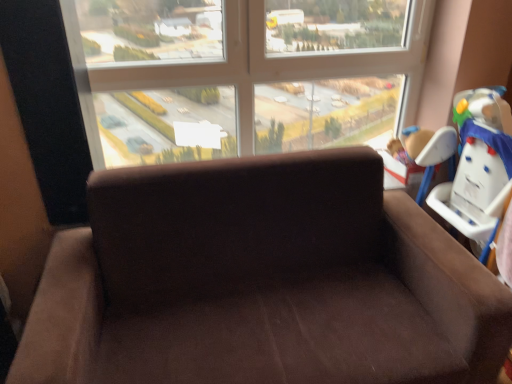
Question: Is the depth of transparent glass window at upper center less than that of brown plush toy at upper right?

Choices:
 (A) no
 (B) yes

Answer: (B)

Question: Is transparent glass window at upper center touching brown plush toy at upper right?

Choices:
 (A) yes
 (B) no

Answer: (B)

Question: Is transparent glass window at upper center smaller than brown plush toy at upper right?

Choices:
 (A) no
 (B) yes

Answer: (A)

Question: Considering the relative sizes of transparent glass window at upper center and brown plush toy at upper right in the image provided, is transparent glass window at upper center shorter than brown plush toy at upper right?

Choices:
 (A) yes
 (B) no

Answer: (B)

Question: From a real-world perspective, is transparent glass window at upper center physically below brown plush toy at upper right?

Choices:
 (A) no
 (B) yes

Answer: (A)

Question: From the image's perspective, is transparent glass window at upper center beneath brown plush toy at upper right?

Choices:
 (A) no
 (B) yes

Answer: (A)

Question: From the image's perspective, would you say suede brown couch at center is positioned over transparent glass window at upper center?

Choices:
 (A) no
 (B) yes

Answer: (A)

Question: Is transparent glass window at upper center surrounded by suede brown couch at center?

Choices:
 (A) no
 (B) yes

Answer: (A)

Question: Is suede brown couch at center not near transparent glass window at upper center?

Choices:
 (A) no
 (B) yes

Answer: (A)

Question: Can you confirm if suede brown couch at center is taller than transparent glass window at upper center?

Choices:
 (A) yes
 (B) no

Answer: (A)

Question: Considering the relative sizes of suede brown couch at center and transparent glass window at upper center in the image provided, is suede brown couch at center thinner than transparent glass window at upper center?

Choices:
 (A) no
 (B) yes

Answer: (A)

Question: From a real-world perspective, is suede brown couch at center over transparent glass window at upper center?

Choices:
 (A) no
 (B) yes

Answer: (A)

Question: Is transparent glass window at upper center bigger than white plastic baby carriage at right?

Choices:
 (A) yes
 (B) no

Answer: (A)